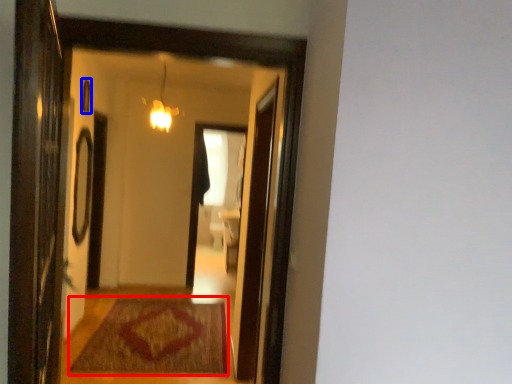
Question: Which of the following is the farthest to the observer, mat (highlighted by a red box) or window (highlighted by a blue box)?

Choices:
 (A) mat
 (B) window

Answer: (B)